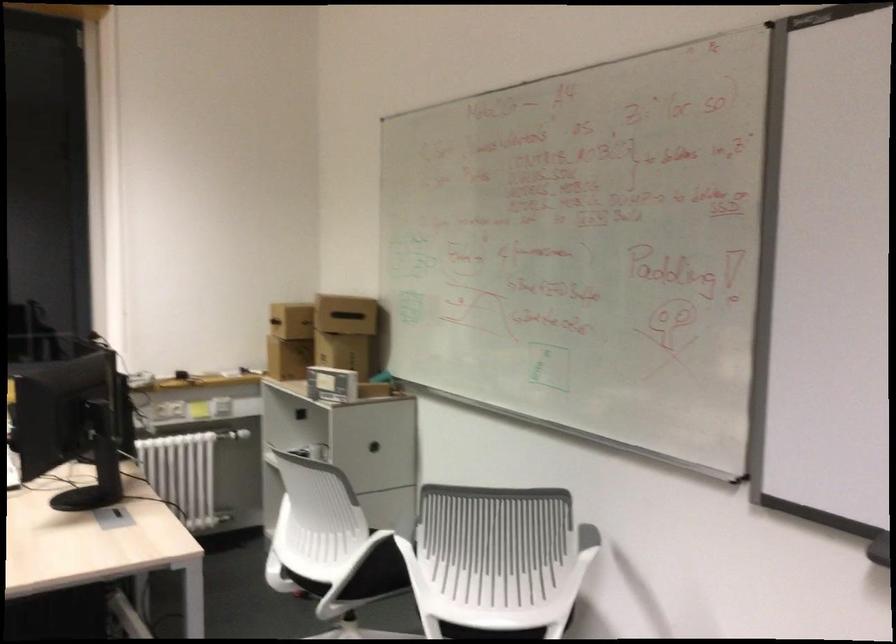
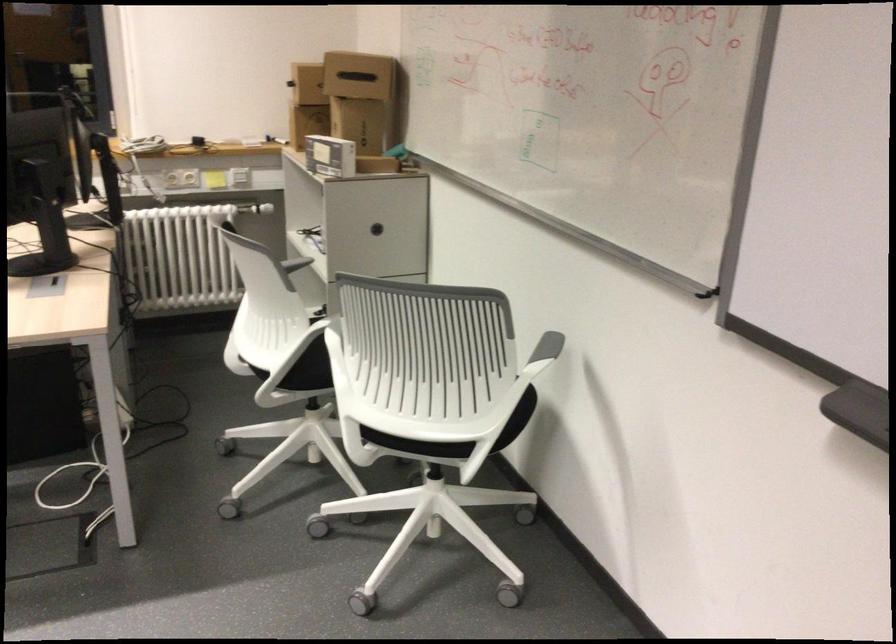
Locate, in the second image, the point that corresponds to [369,446] in the first image.

(375, 229)